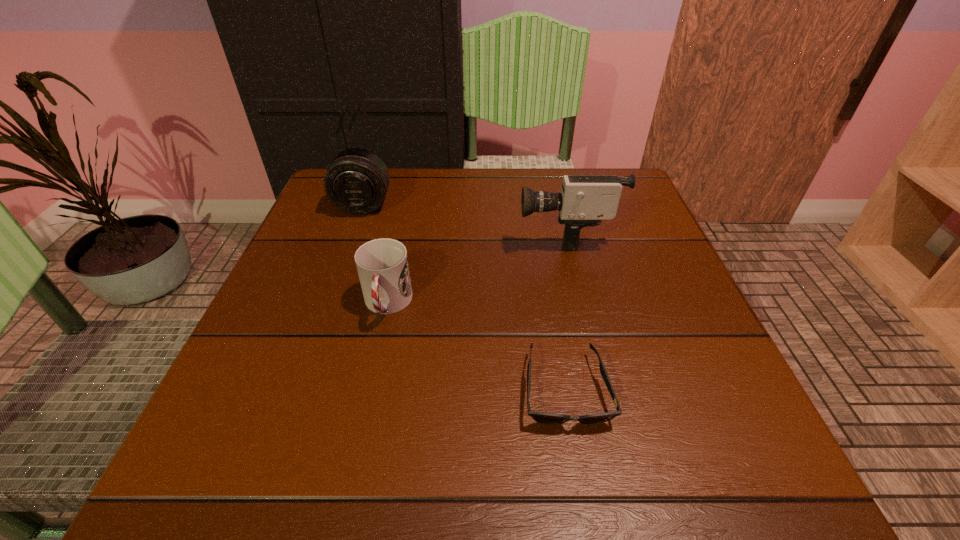
Find the location of `vacant space at the left edge of the desktop`. vacant space at the left edge of the desktop is located at coordinates (282, 404).

Locate an element on the screen. This screenshot has height=540, width=960. vacant region at the right edge of the desktop is located at coordinates (675, 427).

Image resolution: width=960 pixels, height=540 pixels. Identify the location of free space at the near left corner of the desktop. (307, 455).

The image size is (960, 540). In the image, there is a desktop. What are the coordinates of `vacant space at the far right corner` in the screenshot? It's located at (623, 186).

The height and width of the screenshot is (540, 960). What are the coordinates of `free spot between the tallest object and the third farthest object` in the screenshot? It's located at (476, 269).

The width and height of the screenshot is (960, 540). Identify the location of vacant space that's between the tallest object and the sunglasses. (565, 312).

Find the location of `empty space that is in between the tallest object and the nearest object`. empty space that is in between the tallest object and the nearest object is located at coordinates (565, 312).

At what (x,y) coordinates should I click in order to perform the action: click on unoccupied area between the camcorder and the third tallest object. Please return your answer as a coordinate pair (x, y). The height and width of the screenshot is (540, 960). Looking at the image, I should click on (476, 269).

Where is `free point between the camcorder and the second tallest object`? This screenshot has height=540, width=960. free point between the camcorder and the second tallest object is located at coordinates (465, 219).

Identify the location of unoccupied position between the second tallest object and the shortest object. coord(465,297).